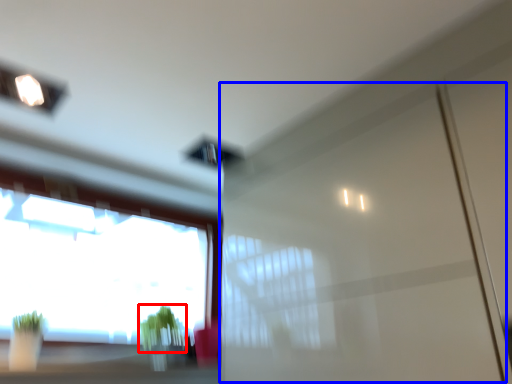
Question: Which of the following is the closest to the observer, plant (highlighted by a red box) or screen door (highlighted by a blue box)?

Choices:
 (A) plant
 (B) screen door

Answer: (B)